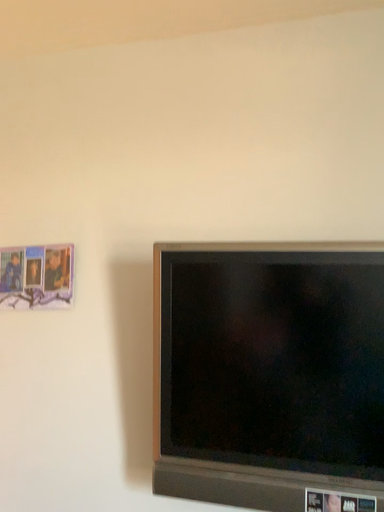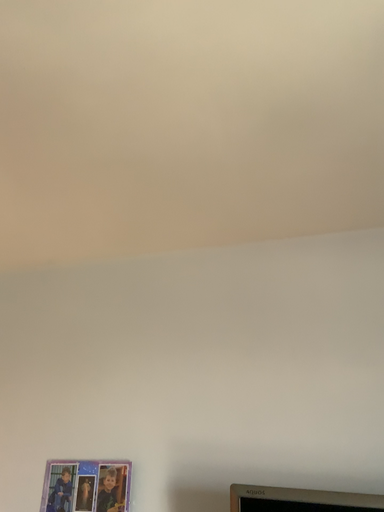
Question: How did the camera likely rotate when shooting the video?

Choices:
 (A) rotated downward
 (B) rotated upward

Answer: (B)